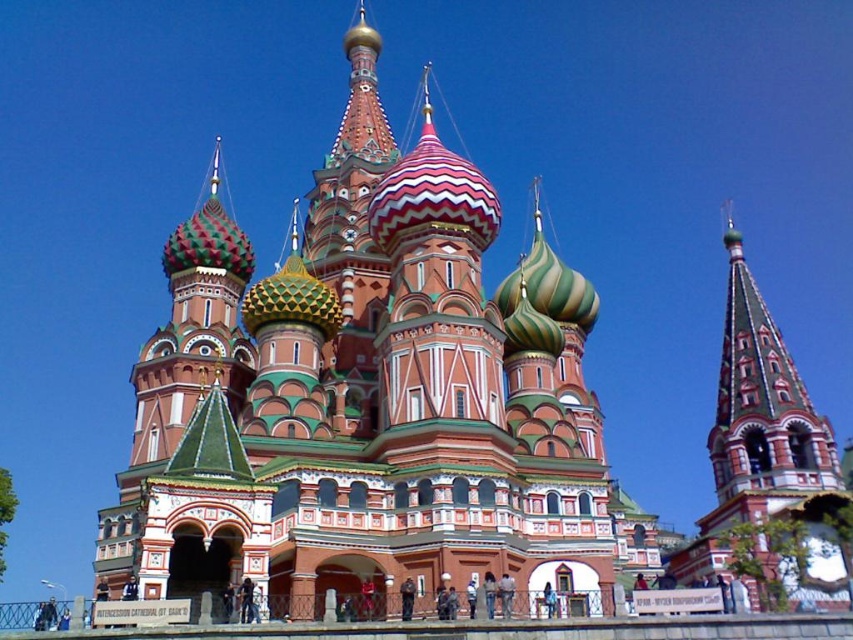
Based on the photo, you are a tourist standing in front of the St. Basil Cathedral. You see the polychrome woodwork church at center and the polished wood spire at right. Which object is bigger?

The polychrome woodwork church at center is larger in size than the polished wood spire at right.

Consider the image. You are a tourist standing in front of the cathedral and want to take a photo that includes both the polychrome woodwork church at center and the polished wood spire at right. Based on their positions, which object should you place on the left side of your photo to capture both in the frame?

The polychrome woodwork church at center is positioned on the left side of the polished wood spire at right, so to include both in the frame, you should place the polychrome woodwork church at center on the left side of your photo.